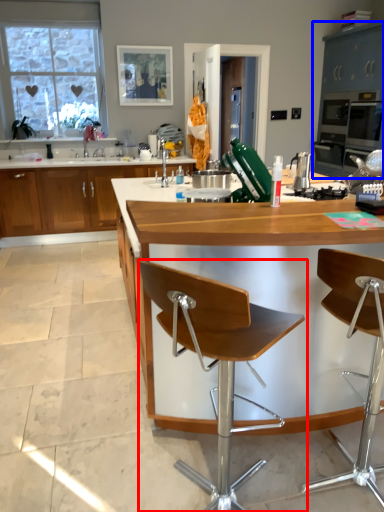
Question: Among these objects, which one is nearest to the camera, chair (highlighted by a red box) or cabinetry (highlighted by a blue box)?

Choices:
 (A) chair
 (B) cabinetry

Answer: (A)